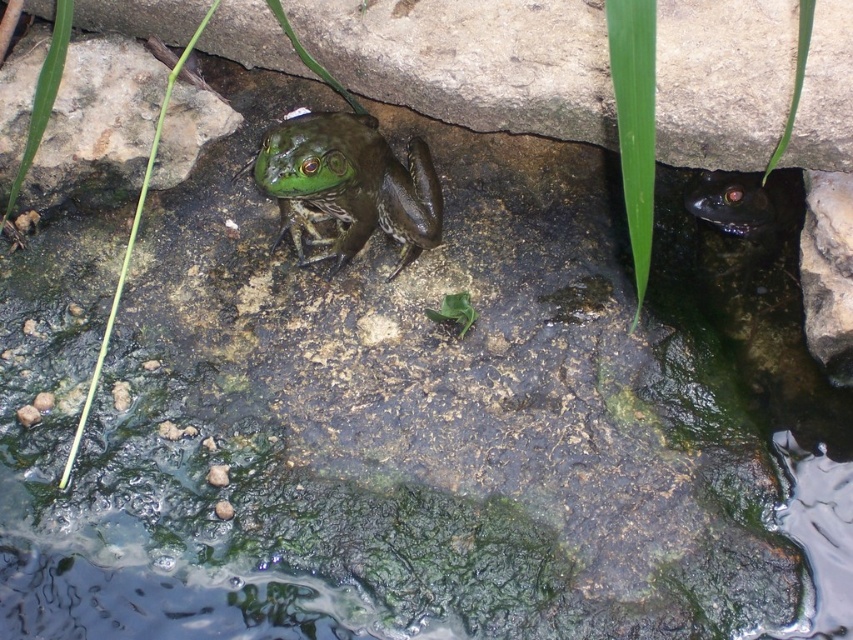
What is located at the point with coordinates (473, 60) in the image?

The point with coordinates (473, 60) is occupied by the green rough stone at center.